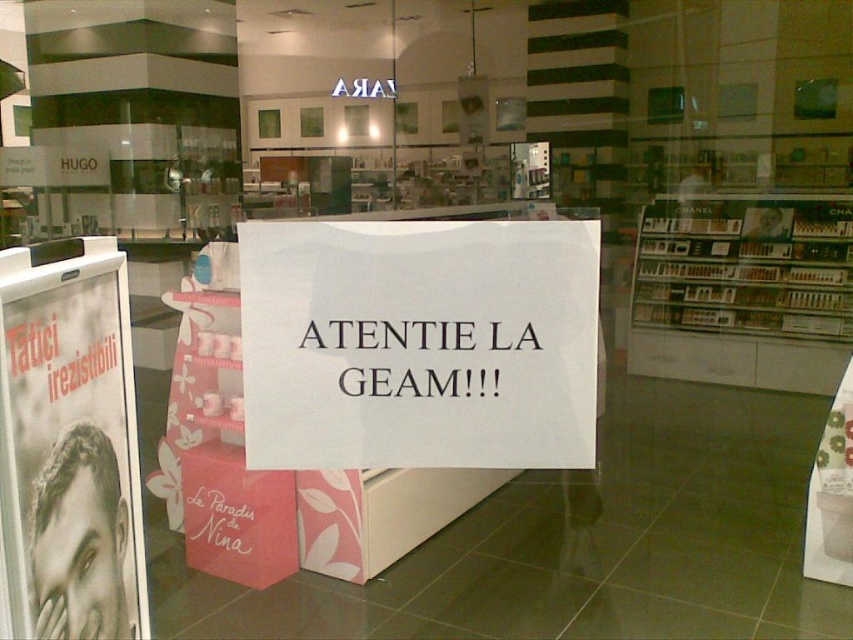
Question: Which object is farther from the camera taking this photo?

Choices:
 (A) black glossy poster at left
 (B) white paper sign at center

Answer: (B)

Question: Can you confirm if white paper sign at center is smaller than black glossy poster at left?

Choices:
 (A) yes
 (B) no

Answer: (B)

Question: Does white paper sign at center lie behind black glossy poster at left?

Choices:
 (A) yes
 (B) no

Answer: (A)

Question: Which of the following is the farthest from the observer?

Choices:
 (A) (30, 518)
 (B) (260, 468)

Answer: (B)

Question: Does white paper sign at center appear under black glossy poster at left?

Choices:
 (A) no
 (B) yes

Answer: (A)

Question: Which object appears closest to the camera in this image?

Choices:
 (A) black glossy poster at left
 (B) white paper sign at center

Answer: (A)